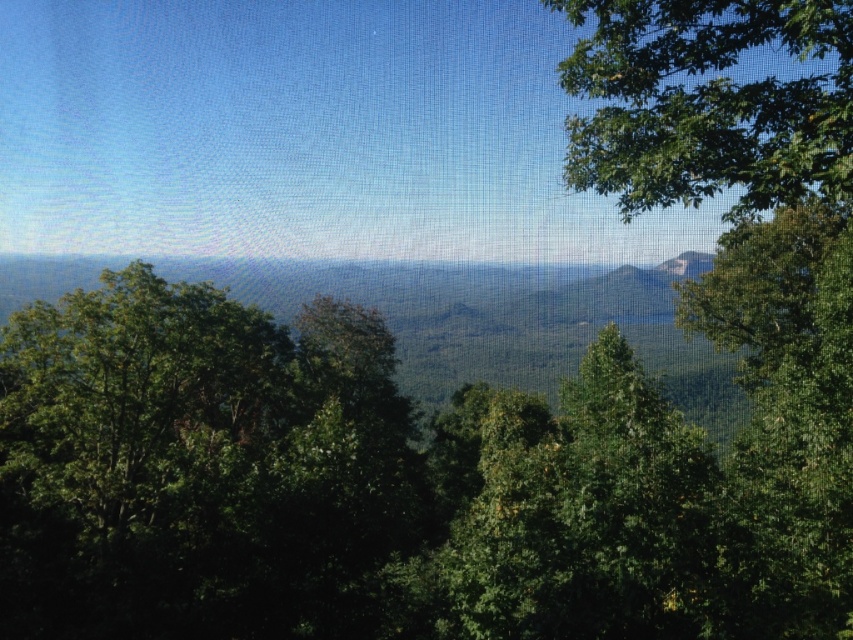
You are standing in the lush landscape and want to take a photo of both the green leafy tree at right and the green mossy rock at upper right. Which object should you focus on first to ensure both are in frame?

The green leafy tree at right is taller than the green mossy rock at upper right, so you should focus on the green leafy tree at right first to ensure both are in frame.

You are standing at the camera position in the lush green landscape. There is a point marked at coordinates point (282,492). Can you estimate how far this point is from your current position?

The point (282,492) is 14.93 meters away from the camera position.